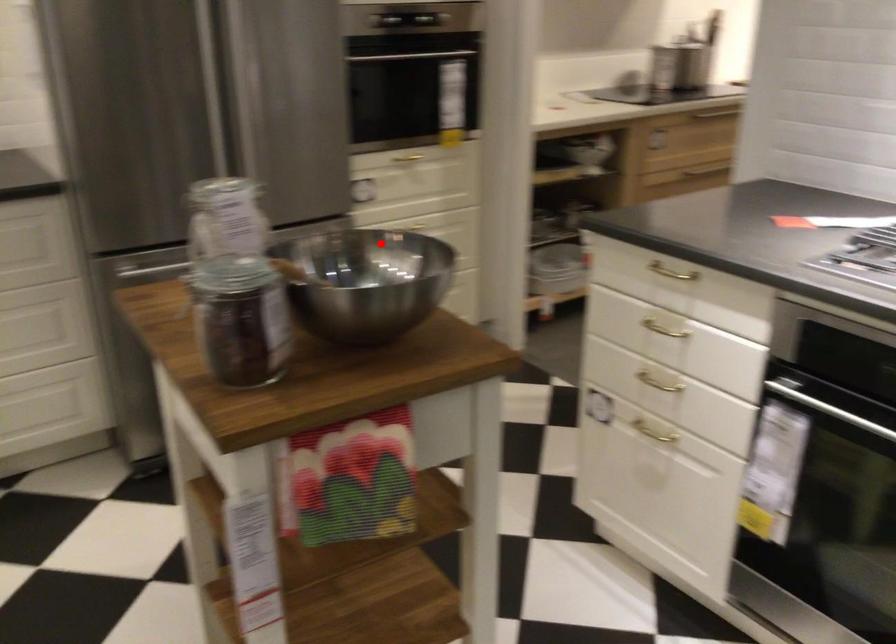
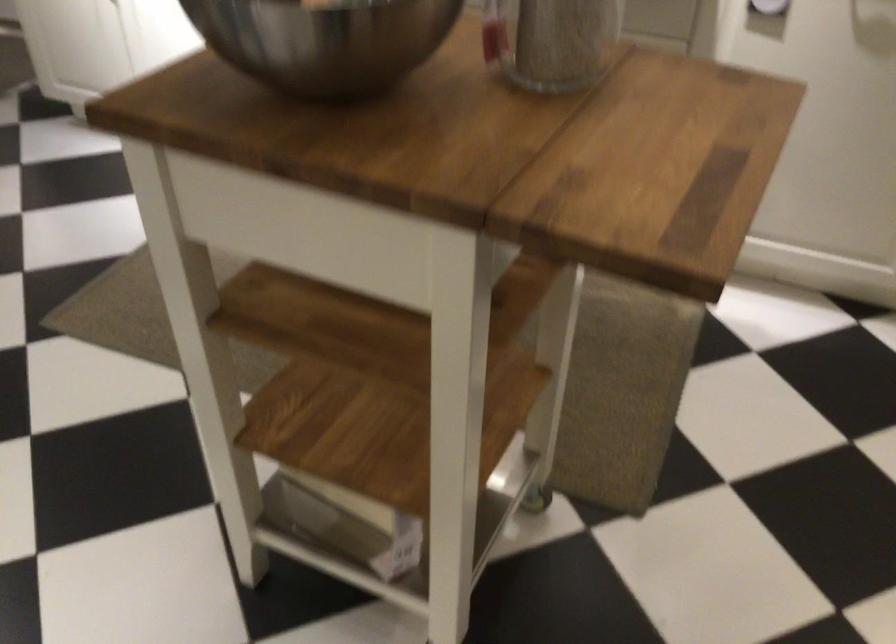
Question: I am providing you with two images of the same scene from different viewpoints. A red point is shown in image1. For the corresponding object point in image2, is it positioned nearer or farther from the camera?

Choices:
 (A) Nearer
 (B) Farther

Answer: (A)